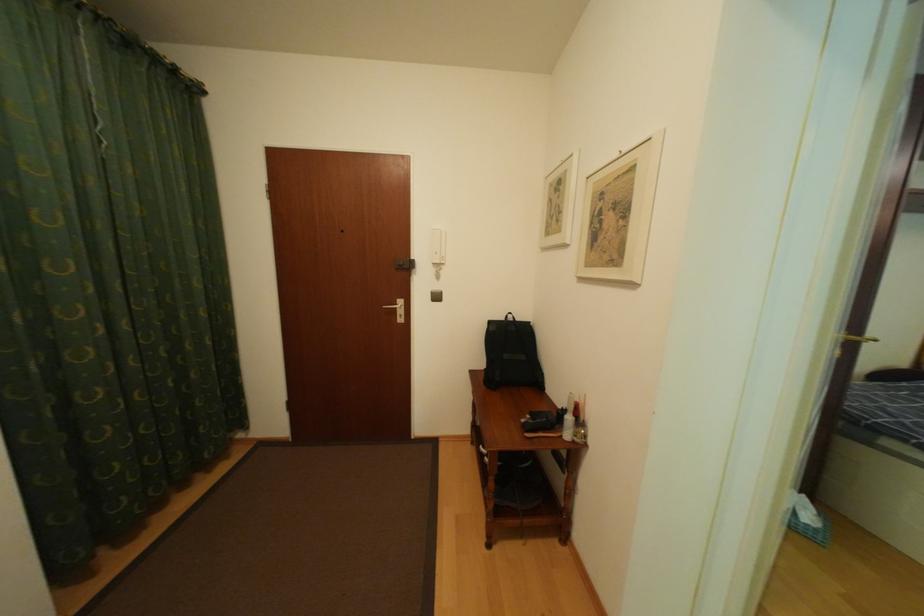
Where is `white dispenser bottle`? white dispenser bottle is located at coordinates (568, 419).